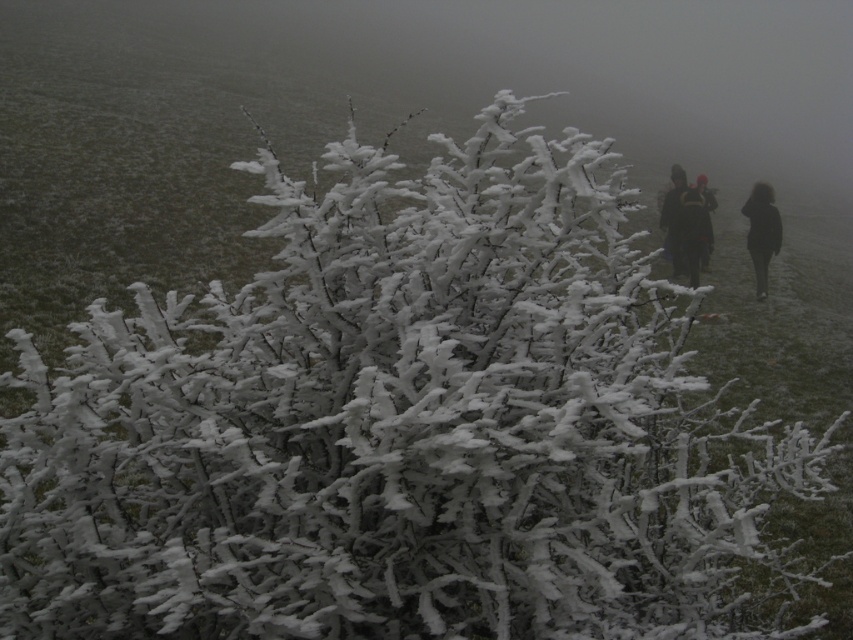
Question: Which point appears farthest from the camera in this image?

Choices:
 (A) (706, 248)
 (B) (751, 257)

Answer: (B)

Question: Does black matte coat at right appear over dark fabric jacket at right?

Choices:
 (A) yes
 (B) no

Answer: (B)

Question: Which point is farther to the camera?

Choices:
 (A) dark blue jacket at right
 (B) dark fabric jacket at right
 (C) black matte coat at right

Answer: (C)

Question: Observing the image, what is the correct spatial positioning of dark fabric jacket at right in reference to dark blue jacket at right?

Choices:
 (A) above
 (B) below

Answer: (B)

Question: Where is black matte coat at right located in relation to dark fabric jacket at right in the image?

Choices:
 (A) right
 (B) left

Answer: (A)

Question: Which point is farther to the camera?

Choices:
 (A) (711, 227)
 (B) (747, 234)

Answer: (A)